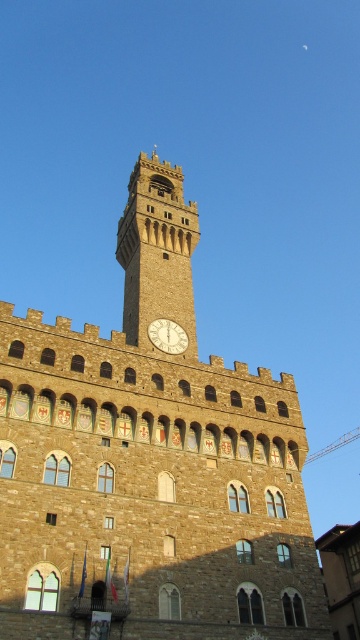
Can you confirm if stone clock tower at center is positioned to the left of white glossy clock at center?

Yes, stone clock tower at center is to the left of white glossy clock at center.

Can you confirm if stone clock tower at center is shorter than white glossy clock at center?

No.

Describe the element at coordinates (156, 252) in the screenshot. This screenshot has width=360, height=640. I see `stone clock tower at center` at that location.

Locate an element on the screen. This screenshot has width=360, height=640. stone clock tower at center is located at coordinates (156, 252).

Who is more distant from viewer, (21, 368) or (183, 339)?

The point (183, 339) is more distant.

At what (x,y) coordinates should I click in order to perform the action: click on brown stone clock tower at center. Please return your answer as a coordinate pair (x, y). Looking at the image, I should click on (150, 465).

Does brown stone clock tower at center appear on the left side of stone clock tower at center?

Incorrect, brown stone clock tower at center is not on the left side of stone clock tower at center.

Is point (172, 611) behind point (120, 260)?

No, it is in front of (120, 260).

Which is in front, point (230, 492) or point (146, 337)?

Point (230, 492) is in front.

Locate an element on the screen. Image resolution: width=360 pixels, height=640 pixels. brown stone clock tower at center is located at coordinates (150, 465).